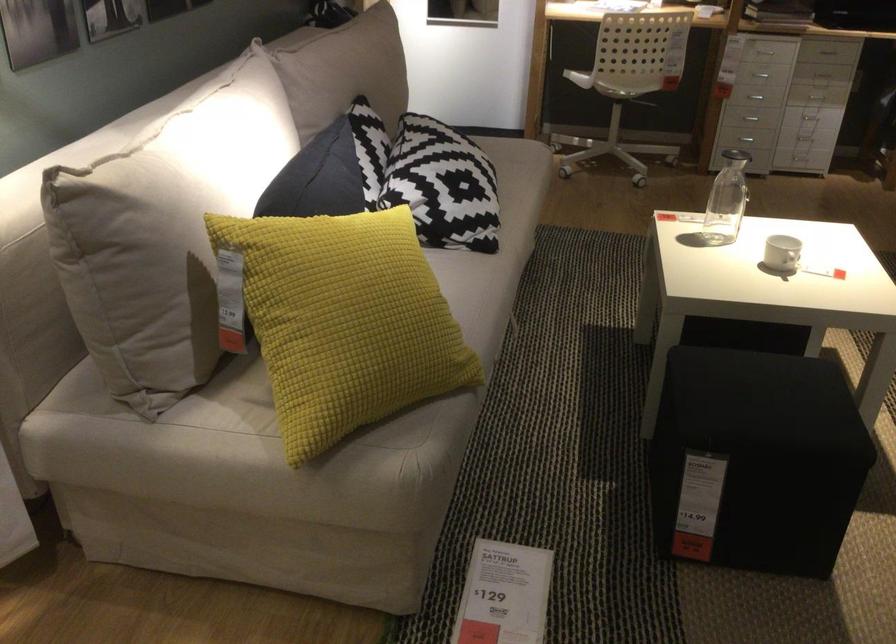
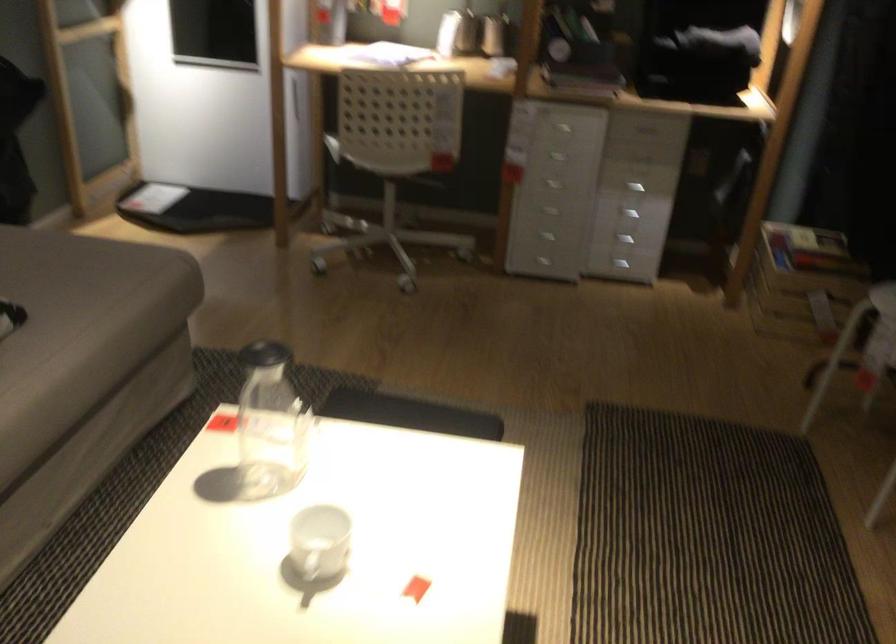
Locate, in the second image, the point that corresponds to (632,73) in the first image.

(388, 158)